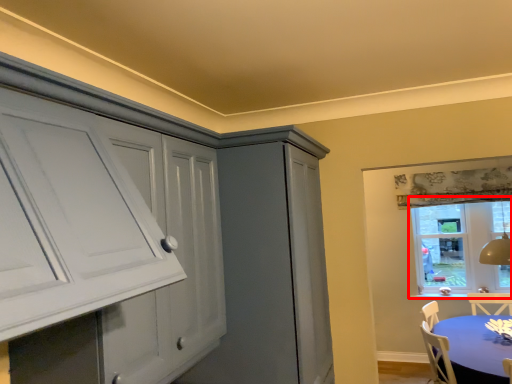
Question: From the image, what is the correct spatial relationship of window (annotated by the red box) in relation to table?

Choices:
 (A) left
 (B) right

Answer: (B)